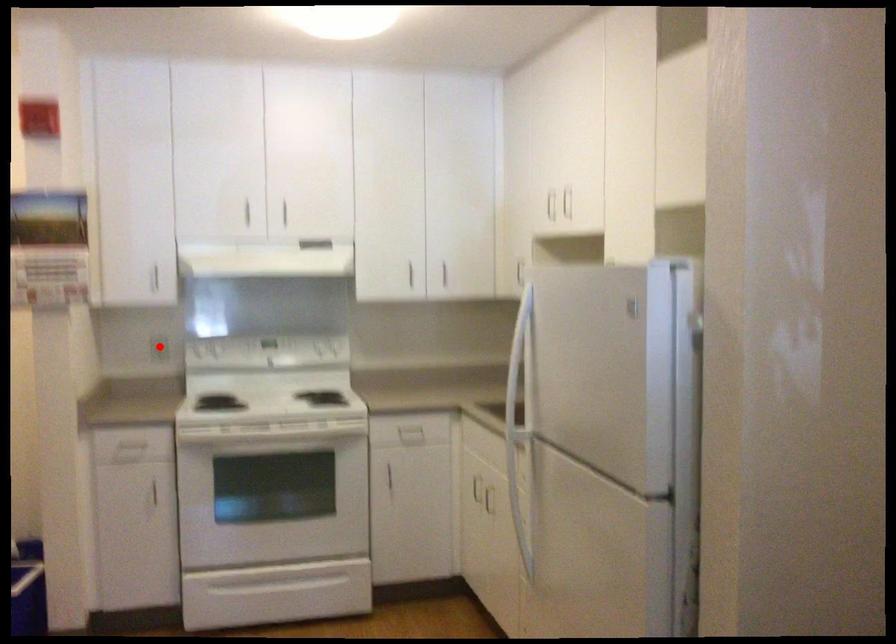
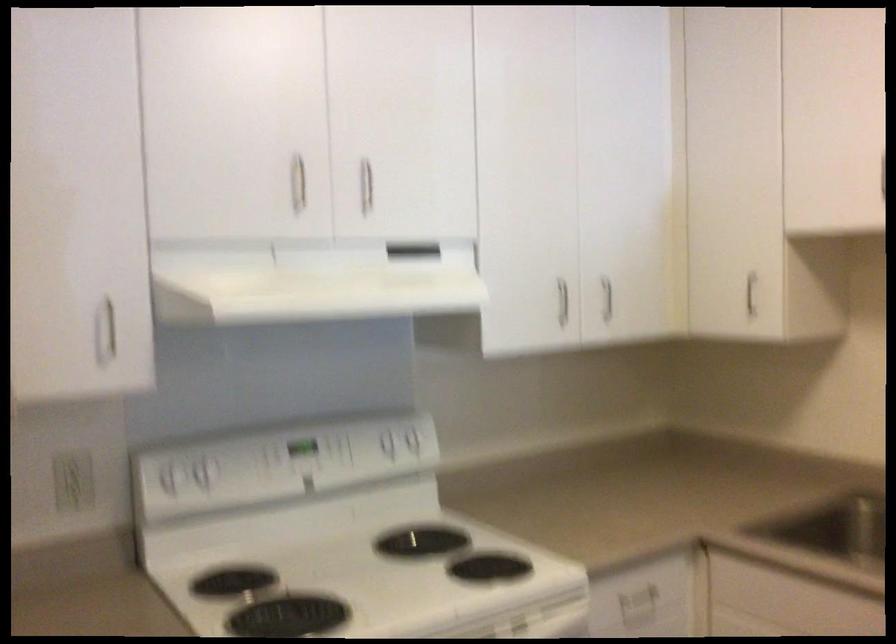
In the second image, find the point that corresponds to the highlighted location in the first image.

(73, 480)